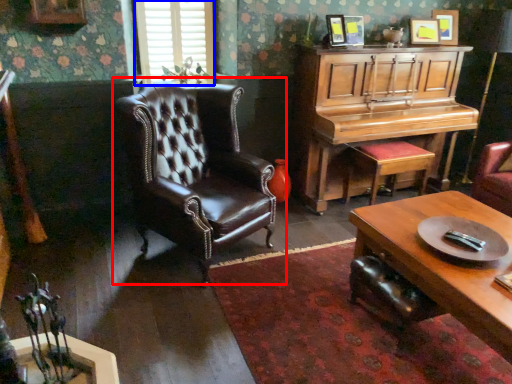
Question: Among these objects, which one is farthest to the camera, chair (highlighted by a red box) or window (highlighted by a blue box)?

Choices:
 (A) chair
 (B) window

Answer: (B)